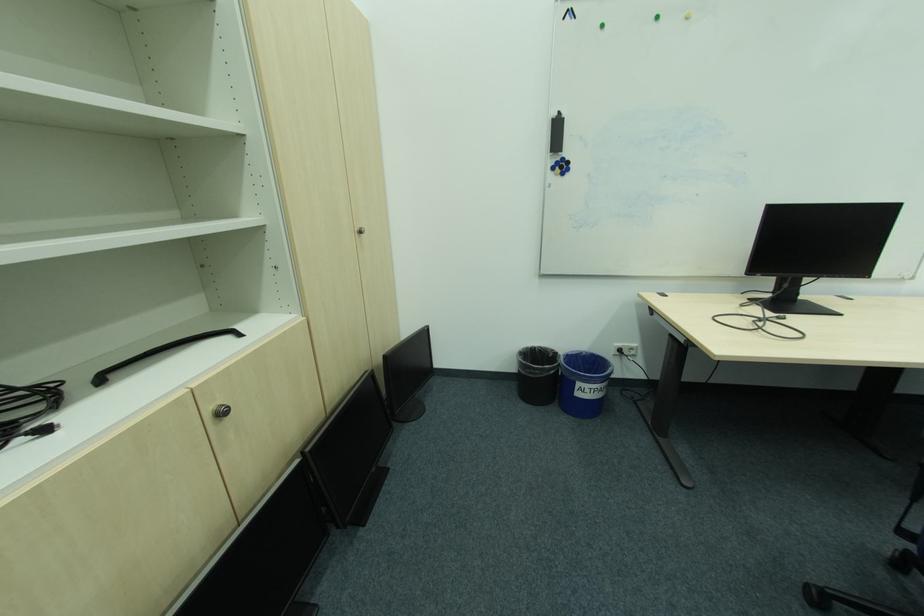
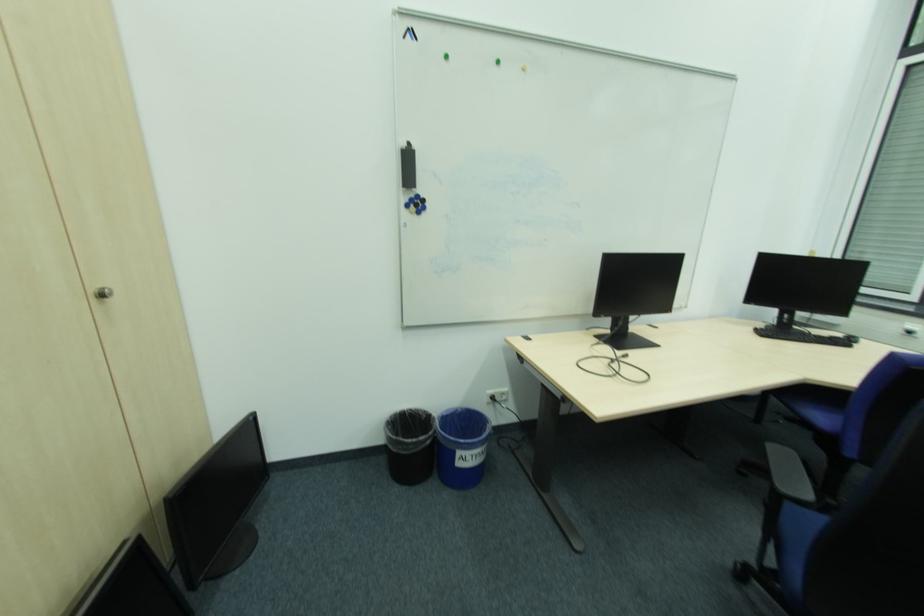
Question: The images are taken continuously from a first-person perspective. In which direction is your viewpoint rotating?

Choices:
 (A) Left
 (B) Right
 (C) Up
 (D) Down

Answer: (B)